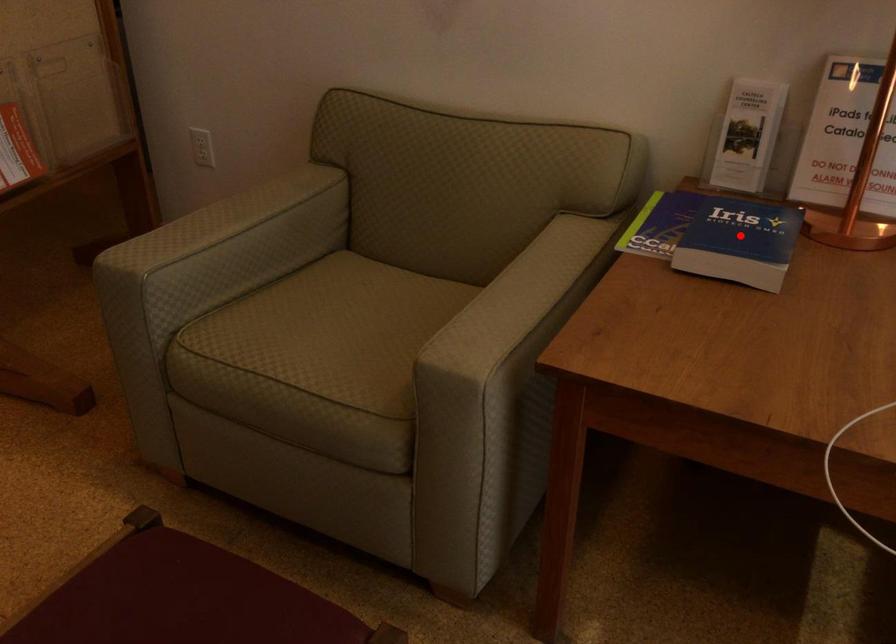
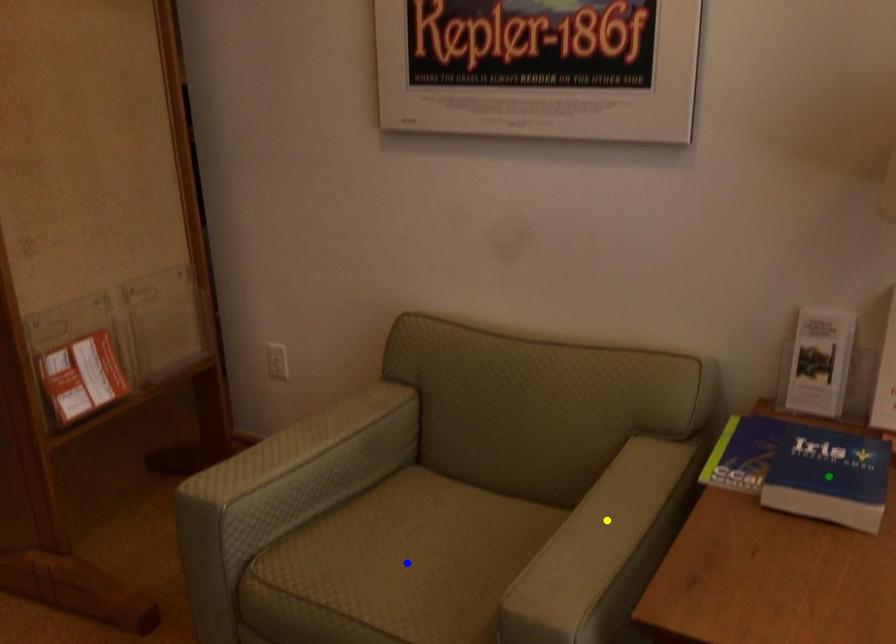
Question: I am providing you with two images of the same scene from different viewpoints. A red point is marked on the first image. You are given multiple points on the second image. Which spot in image 2 lines up with the point in image 1?

Choices:
 (A) yellow point
 (B) blue point
 (C) green point

Answer: (C)